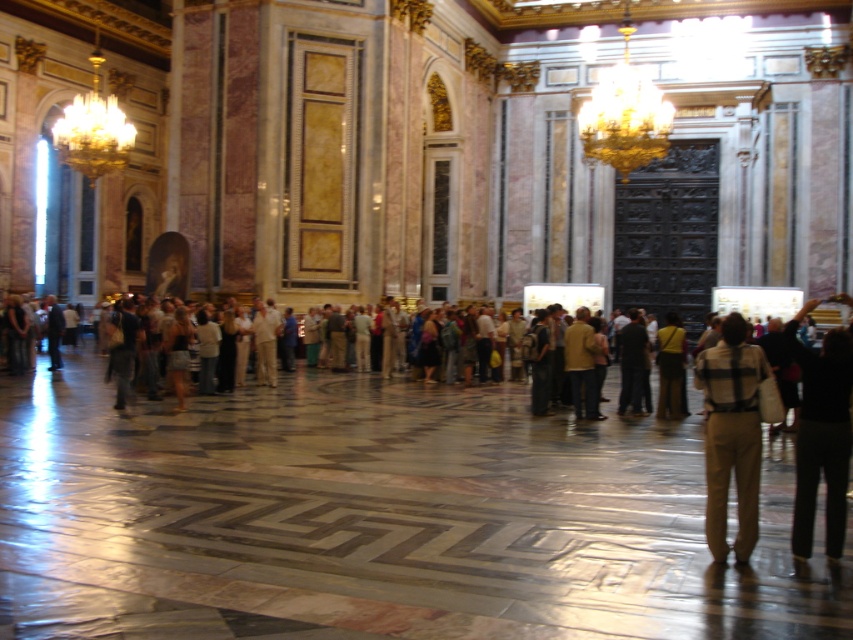
You are standing in the grand ornate building and want to place a small potted plant exactly where the khaki cotton pants at center are located. Is this location suitable for placing the plant?

The khaki cotton pants at center is located at point (730, 435), so placing the plant there would be suitable as long as the coordinates align with the desired placement area.